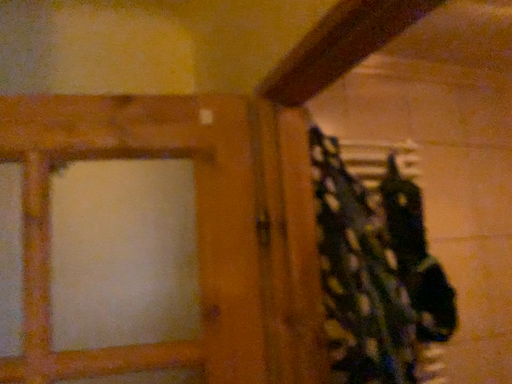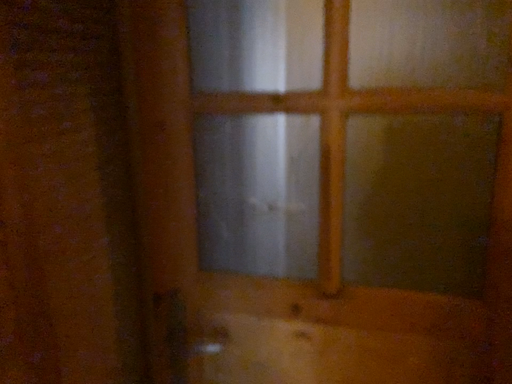
Question: How did the camera likely rotate when shooting the video?

Choices:
 (A) rotated upward
 (B) rotated downward

Answer: (B)